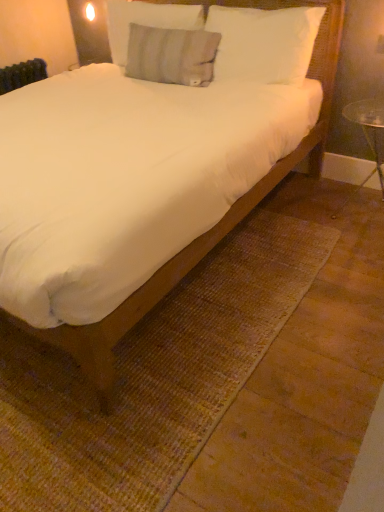
Question: Is white soft bed at center taller or shorter than white soft pillow at upper center, positioned as the 1th pillow in right-to-left order?

Choices:
 (A) tall
 (B) short

Answer: (A)

Question: From a real-world perspective, is white soft bed at center positioned above or below white soft pillow at upper center, which ranks as the 3th pillow in left-to-right order?

Choices:
 (A) above
 (B) below

Answer: (B)

Question: Considering the real-world distances, which object is closest to the white soft pillow at upper center, which ranks as the 3th pillow in left-to-right order?

Choices:
 (A) white soft bed at center
 (B) gray textured pillow at upper center, positioned as the 1th pillow in left-to-right order
 (C) gray cotton pillow at upper center, acting as the second pillow starting from the left

Answer: (C)

Question: Which object is the farthest from the gray cotton pillow at upper center, which appears as the second pillow when viewed from the right?

Choices:
 (A) gray textured pillow at upper center, marked as the 3th pillow in a right-to-left arrangement
 (B) white soft pillow at upper center, which ranks as the 3th pillow in left-to-right order
 (C) white soft bed at center

Answer: (C)